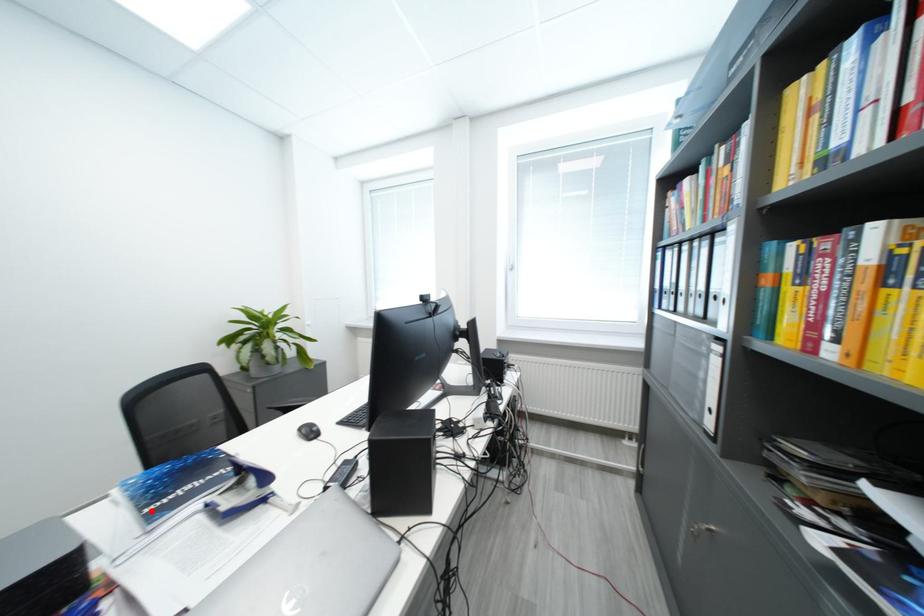
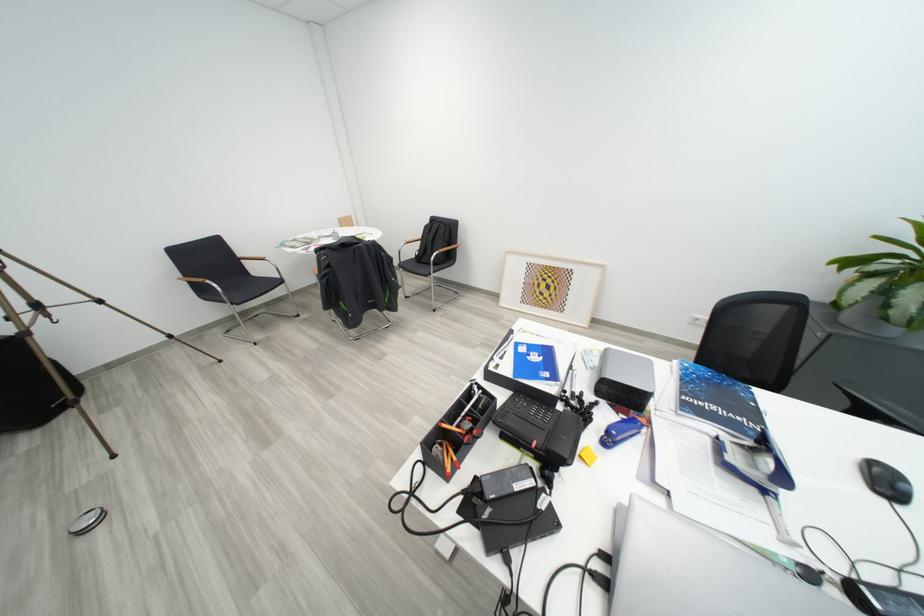
The point at the highlighted location is marked in the first image. Where is the corresponding point in the second image?

(691, 395)